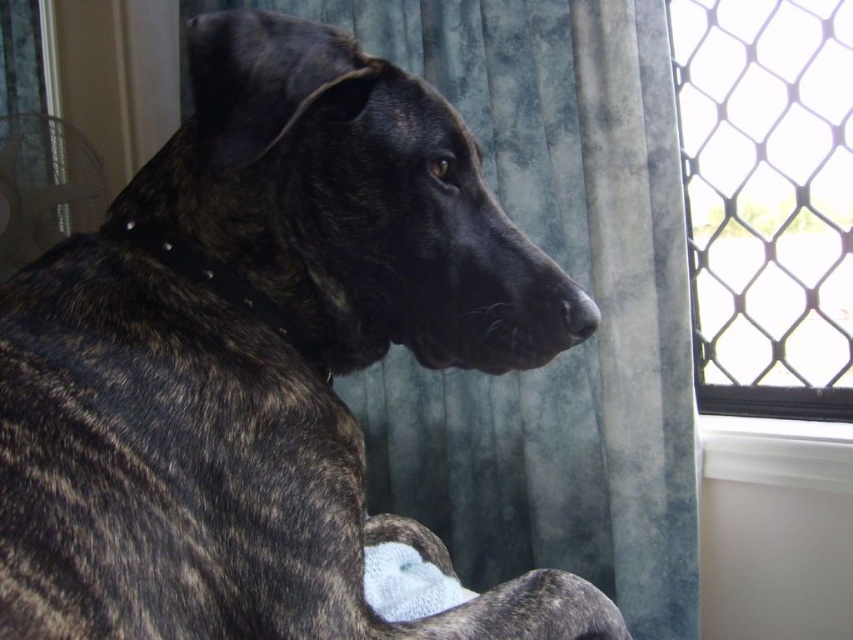
Does black mesh screen at upper right appear on the left side of white plastic window sill at lower right?

No, black mesh screen at upper right is not to the left of white plastic window sill at lower right.

Between point (837, 317) and point (778, 461), which one is positioned behind?

Point (837, 317)

Where is `black mesh screen at upper right`? This screenshot has height=640, width=853. black mesh screen at upper right is located at coordinates (767, 202).

Does brindle fur at center have a larger size compared to black mesh screen at upper right?

Yes, brindle fur at center is bigger than black mesh screen at upper right.

Is point (86, 380) positioned in front of point (782, 29)?

Yes.

This screenshot has width=853, height=640. I want to click on brindle fur at center, so click(x=262, y=360).

Find the location of a particular element. brindle fur at center is located at coordinates (262, 360).

Is brindle fur at center to the right of white plastic window sill at lower right from the viewer's perspective?

In fact, brindle fur at center is to the left of white plastic window sill at lower right.

Is point (210, 141) farther from viewer compared to point (729, 445)?

No, (210, 141) is closer to viewer.

Is point (515, 269) in front of point (773, 468)?

Yes, point (515, 269) is in front of point (773, 468).

Locate an element on the screen. The width and height of the screenshot is (853, 640). brindle fur at center is located at coordinates (262, 360).